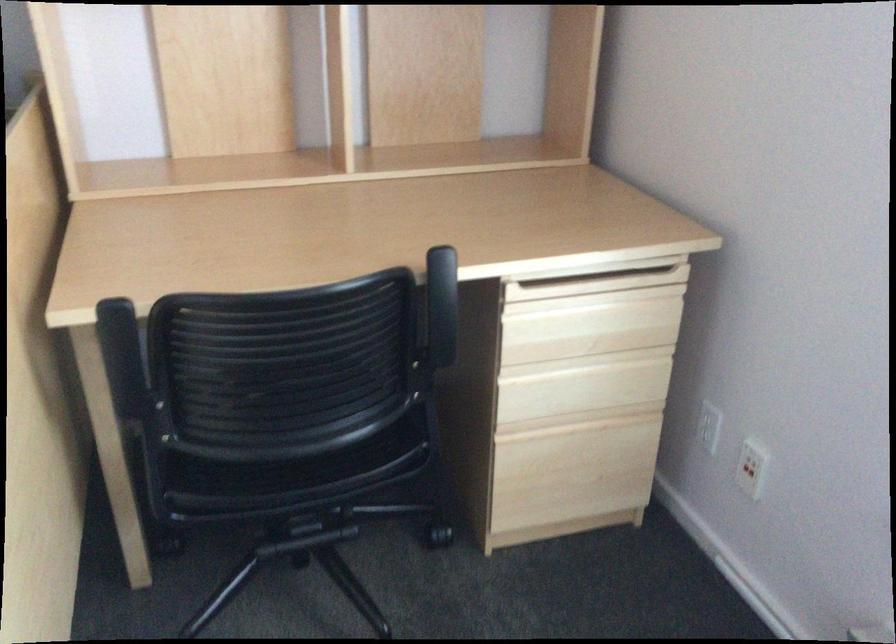
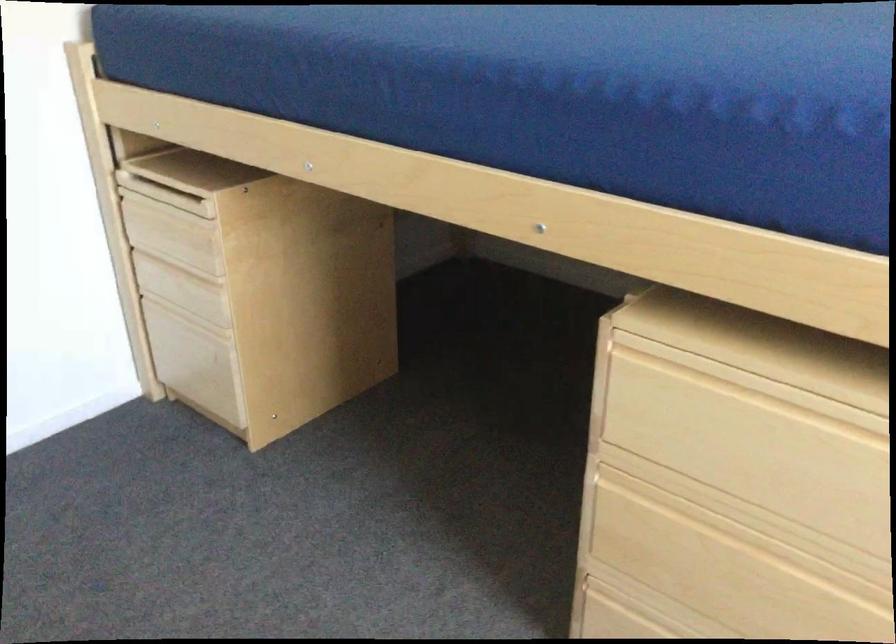
Question: The camera is either moving clockwise (left) or counter-clockwise (right) around the object. The first image is from the beginning of the video and the second image is from the end. Is the camera moving left or right when shooting the video?

Choices:
 (A) Left
 (B) Right

Answer: (B)